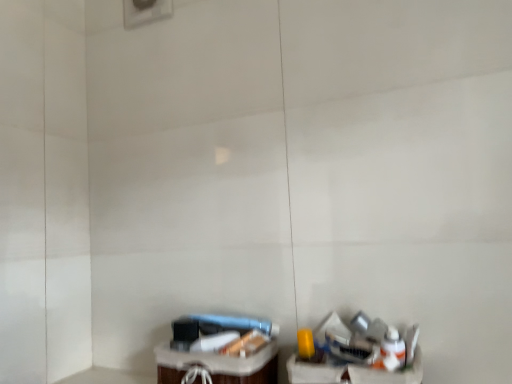
Question: From a real-world perspective, is metallic silver trash can at lower right above or below translucent plastic basket at lower center?

Choices:
 (A) above
 (B) below

Answer: (A)

Question: Is metallic silver trash can at lower right taller or shorter than translucent plastic basket at lower center?

Choices:
 (A) short
 (B) tall

Answer: (B)

Question: In the image, is metallic silver trash can at lower right positioned in front of or behind translucent plastic basket at lower center?

Choices:
 (A) front
 (B) behind

Answer: (A)

Question: From their relative heights in the image, would you say translucent plastic basket at lower center is taller or shorter than metallic silver trash can at lower right?

Choices:
 (A) tall
 (B) short

Answer: (B)

Question: From a real-world perspective, relative to metallic silver trash can at lower right, is translucent plastic basket at lower center vertically above or below?

Choices:
 (A) above
 (B) below

Answer: (B)

Question: Considering the positions of point (267, 359) and point (318, 342), is point (267, 359) closer or farther from the camera than point (318, 342)?

Choices:
 (A) farther
 (B) closer

Answer: (A)

Question: Is translucent plastic basket at lower center wider or thinner than metallic silver trash can at lower right?

Choices:
 (A) wide
 (B) thin

Answer: (A)